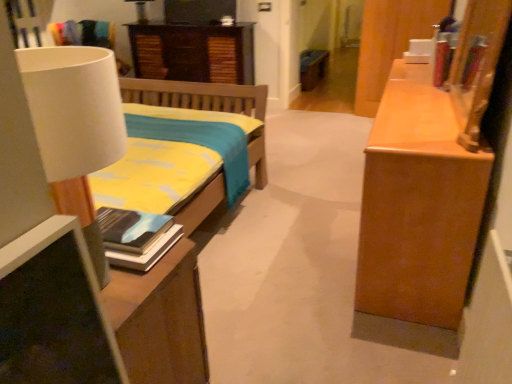
Question: From their relative heights in the image, would you say matte white lampshade at upper left, the second lamp when ordered from front to back, is taller or shorter than dark wood cabinet at upper center?

Choices:
 (A) short
 (B) tall

Answer: (A)

Question: In the image, is matte white lampshade at upper left, the first lamp positioned from the left, on the left side or the right side of dark wood cabinet at upper center?

Choices:
 (A) left
 (B) right

Answer: (A)

Question: Estimate the real-world distances between objects in this image. Which object is farther from the matte white lampshade at upper left, which appears as the 2th lamp when viewed from the right?

Choices:
 (A) hardcover book at left
 (B) white matte lamp at left, which is the 1th lamp in front-to-back order
 (C) wooden cabinet at right, the first cabinetry when ordered from right to left
 (D) dark wood cabinet at upper center
 (E) wooden cabinet at center, the second cabinetry viewed from the right

Answer: (B)

Question: Considering the real-world distances, which object is farthest from the matte white lampshade at upper left, the second lamp when ordered from front to back?

Choices:
 (A) wooden cabinet at right, the 2th cabinetry from the back
 (B) wooden cabinet at center, which ranks as the 1th cabinetry in back-to-front order
 (C) dark wood cabinet at upper center
 (D) white matte lamp at left, which is counted as the 2th lamp, starting from the back
 (E) hardcover book at left

Answer: (D)